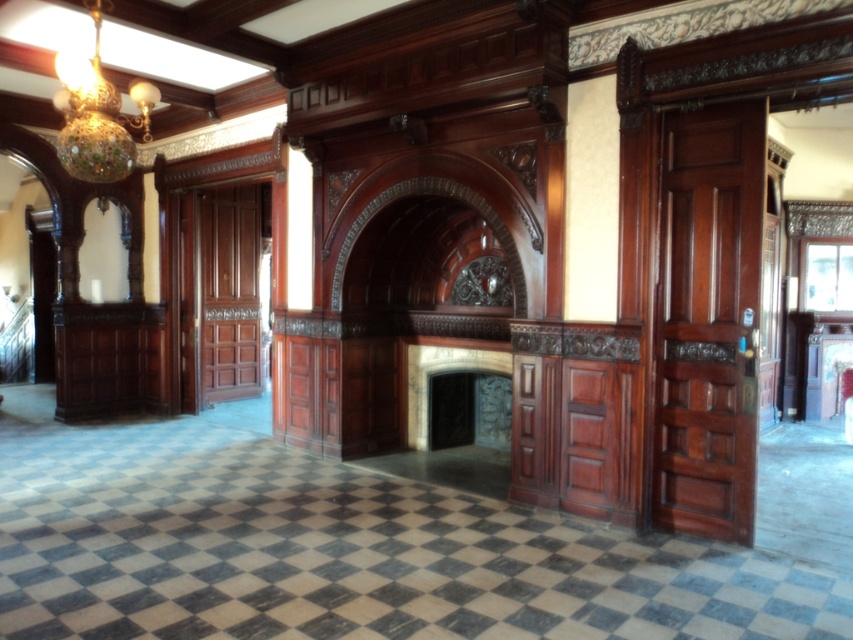
You are standing in the room and want to determine which of the two points, point (109,180) or point (425,381), is closer to you. Based on the scene description, which point is nearer?

Point (109,180) is closer to the camera than point (425,381).

You are standing in the center of the room and see the point at coordinates [97,113]. What object is located at that point?

The point at coordinates [97,113] corresponds to the multicolored glass chandelier at upper left.

You are an interior designer planning to install a new lighting fixture. You have a design that requires the fixture to be wider than the dark stone fireplace at center. Based on the image, can the multicolored glass chandelier at upper left be used for this design?

The multicolored glass chandelier at upper left has a width less than the dark stone fireplace at center, so it cannot be used for the design requiring a wider fixture.